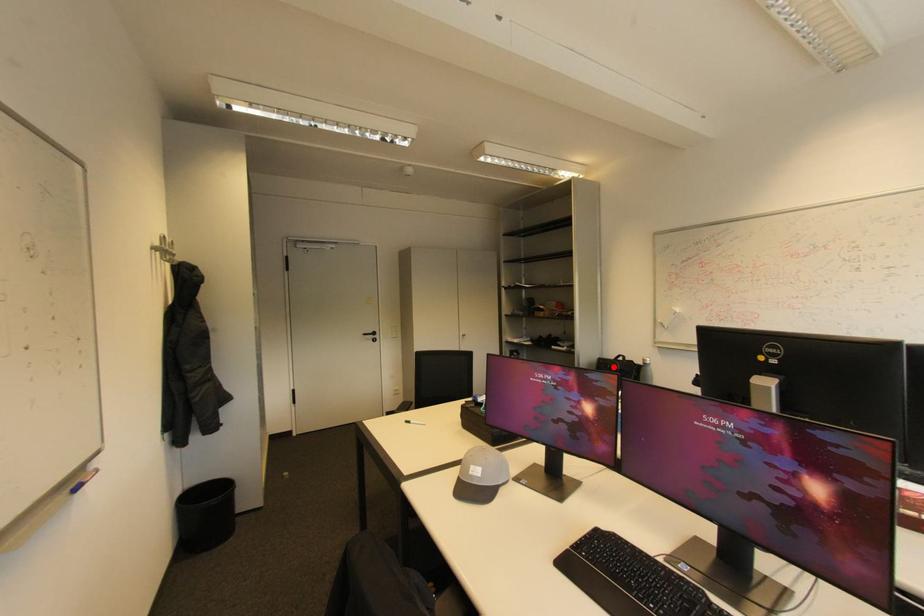
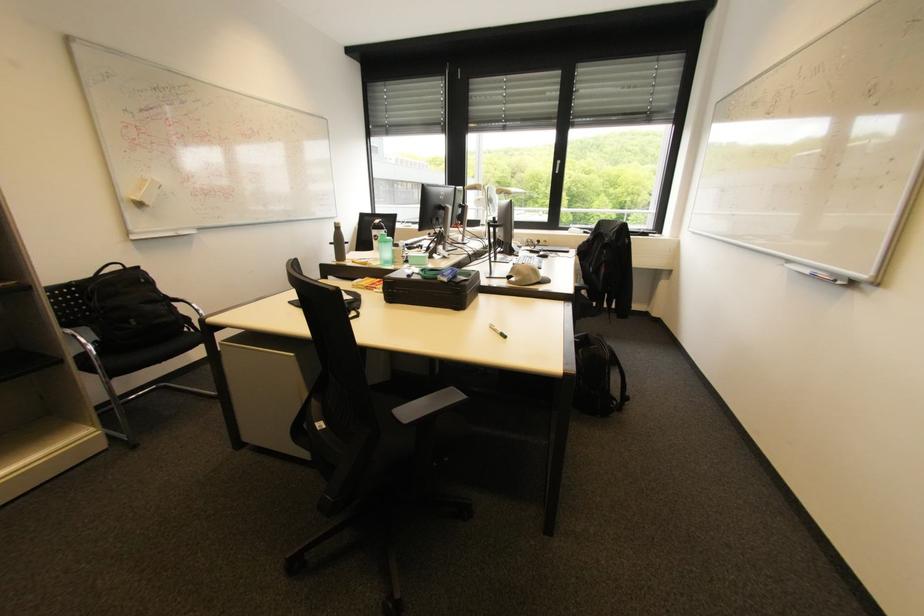
Find the pixel in the second image that matches the highlighted location in the first image.

(148, 281)